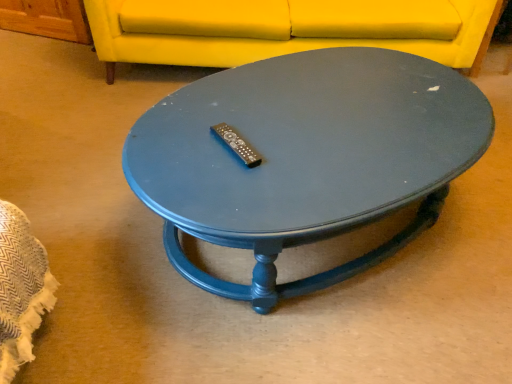
Identify the location of vacant area on top of matte blue coffee table at center (from a real-world perspective). click(x=324, y=118).